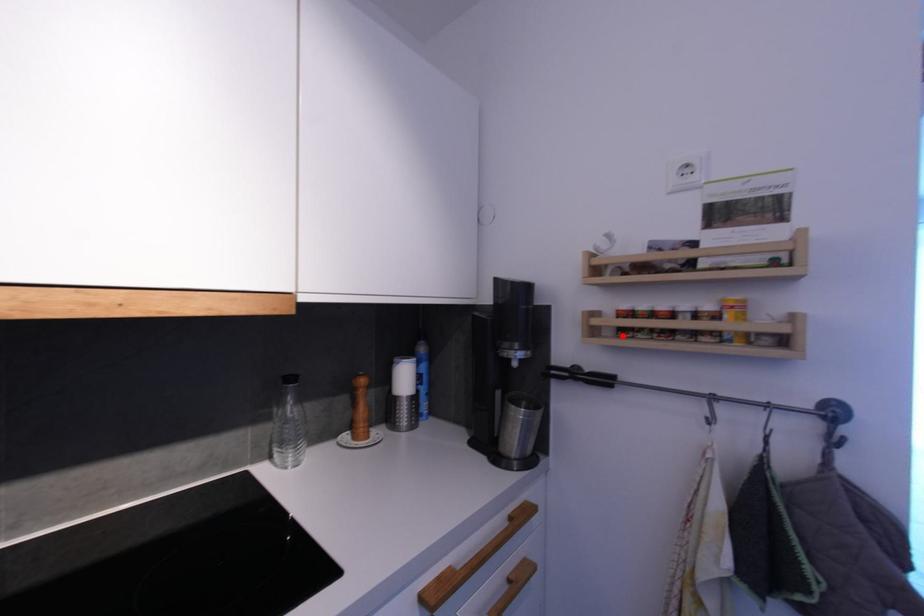
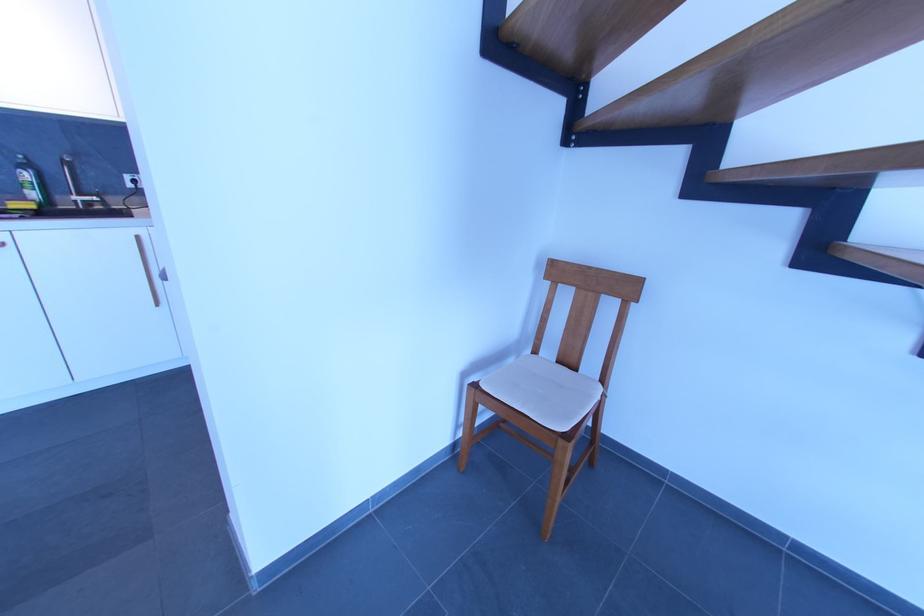
Question: I am providing you with two images of the same scene from different viewpoints. A red point is marked on the first image. At the location where the point appears in image 1, is it still visible in image 2?

Choices:
 (A) Yes
 (B) No

Answer: (B)